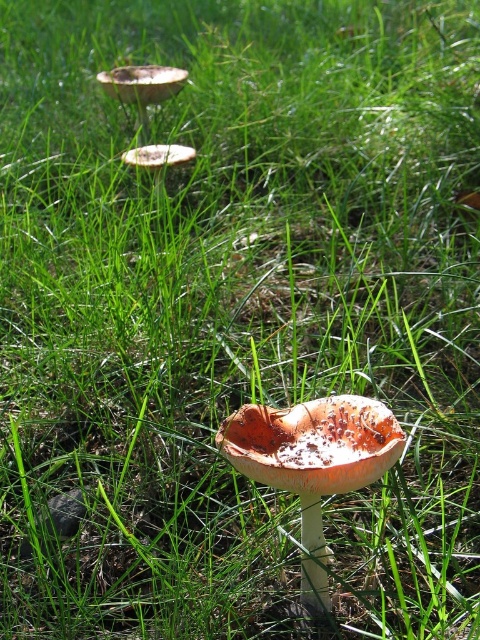
Please look at the scene described. There is a point labeled at coordinates (313, 461). What object is located at that point?

The point at (313, 461) marks the orange matte mushroom at center.